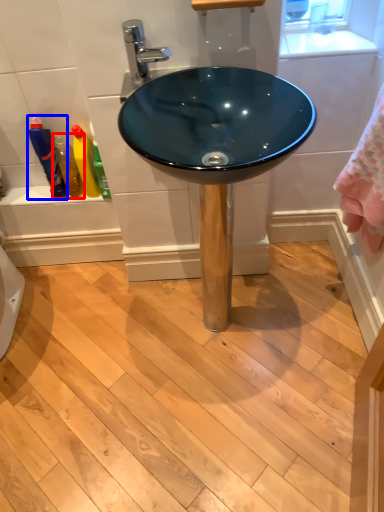
Question: Which of the following is the closest to the observer, toiletry (highlighted by a red box) or bottle (highlighted by a blue box)?

Choices:
 (A) toiletry
 (B) bottle

Answer: (B)